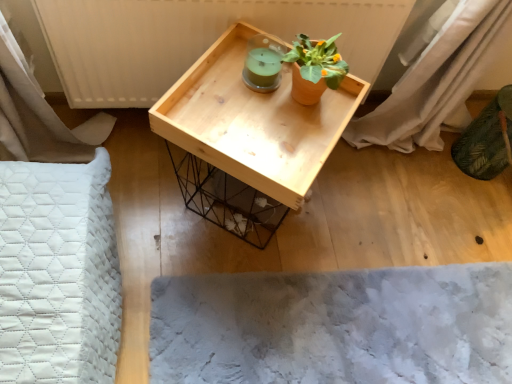
Question: Is point coord(484,284) positioned closer to the camera than point coord(312,77)?

Choices:
 (A) farther
 (B) closer

Answer: (A)

Question: From a real-world perspective, relative to terracotta clay pot at upper center, is fuzzy gray mat at lower center vertically above or below?

Choices:
 (A) below
 (B) above

Answer: (A)

Question: Which object is the closest to the matte white radiator at upper center?

Choices:
 (A) terracotta clay pot at upper center
 (B) fuzzy gray mat at lower center
 (C) natural wood tray at center

Answer: (C)

Question: Considering the real-world distances, which object is farthest from the matte white radiator at upper center?

Choices:
 (A) fuzzy gray mat at lower center
 (B) natural wood tray at center
 (C) terracotta clay pot at upper center

Answer: (A)